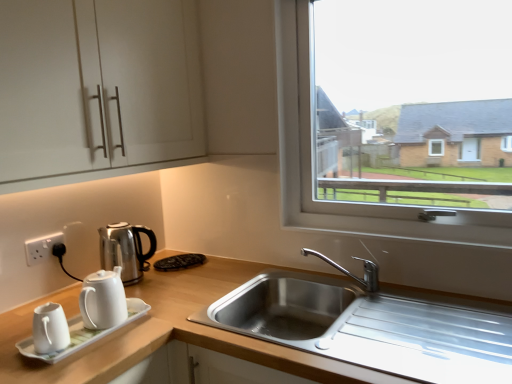
Where is `clear glass window at upper right`? Image resolution: width=512 pixels, height=384 pixels. clear glass window at upper right is located at coordinates (313, 163).

Describe the element at coordinates (93, 315) in the screenshot. I see `white ceramic tea set at lower left` at that location.

Find the location of a particular element. white ceramic tea set at lower left is located at coordinates (93, 315).

Locate an element on the screen. This screenshot has width=512, height=384. white glossy coffee pot at left is located at coordinates (126, 250).

Measure the distance between point (x=133, y=269) and camera.

1.60 meters.

Where is `white plastic electric outlet at lower left`? white plastic electric outlet at lower left is located at coordinates (42, 247).

The image size is (512, 384). Find the location of `white matte cabinet at upper left`. white matte cabinet at upper left is located at coordinates click(239, 76).

Relative to white plastic electric outlet at lower left, is white ceramic tea set at lower left in front or behind?

white ceramic tea set at lower left is in front of white plastic electric outlet at lower left.

Is white ceramic tea set at lower left facing towards white plastic electric outlet at lower left?

No, white ceramic tea set at lower left is not facing towards white plastic electric outlet at lower left.

Between point (49, 357) and point (52, 242), which one is positioned in front?

Point (49, 357)

Who is taller, clear glass window at upper right or white plastic electric outlet at lower left?

With more height is clear glass window at upper right.

I want to click on electric outlet located underneath the clear glass window at upper right (from a real-world perspective), so click(x=42, y=247).

How far apart are clear glass window at upper right and white plastic electric outlet at lower left?

A distance of 3.58 feet exists between clear glass window at upper right and white plastic electric outlet at lower left.

Based on the photo, does clear glass window at upper right have a larger size compared to white plastic electric outlet at lower left?

Correct, clear glass window at upper right is larger in size than white plastic electric outlet at lower left.

Who is smaller, white glossy coffee pot at left or clear glass window at upper right?

With smaller size is white glossy coffee pot at left.

Is point (106, 263) farther from camera compared to point (288, 60)?

That is True.

Is white glossy coffee pot at left inside the boundaries of clear glass window at upper right, or outside?

white glossy coffee pot at left exists outside the volume of clear glass window at upper right.

Is white glossy coffee pot at left not within white ceramic tea set at lower left?

Yes, white glossy coffee pot at left is not within white ceramic tea set at lower left.

Measure the distance from white glossy coffee pot at left to white ceramic tea set at lower left.

The distance of white glossy coffee pot at left from white ceramic tea set at lower left is 12.72 inches.

Locate an element on the screen. This screenshot has height=384, width=512. tea set lying on the right of white glossy coffee pot at left is located at coordinates (93, 315).

Is white glossy coffee pot at left far away from white ceramic tea set at lower left?

Actually, white glossy coffee pot at left and white ceramic tea set at lower left are a little close together.

Consider the image. Is white plastic electric outlet at lower left outside of clear glass window at upper right?

Yes, white plastic electric outlet at lower left is located beyond the bounds of clear glass window at upper right.

Which object is positioned more to the left, white plastic electric outlet at lower left or clear glass window at upper right?

Positioned to the left is white plastic electric outlet at lower left.

From a real-world perspective, is white plastic electric outlet at lower left located beneath clear glass window at upper right?

Indeed, from a real-world perspective, white plastic electric outlet at lower left is positioned beneath clear glass window at upper right.

Considering their positions, is white plastic electric outlet at lower left located in front of or behind clear glass window at upper right?

Visually, white plastic electric outlet at lower left is located behind clear glass window at upper right.

In terms of height, does stainless steel sink at lower center look taller or shorter compared to white matte cabinet at upper left?

In the image, stainless steel sink at lower center appears to be shorter than white matte cabinet at upper left.

From the image's perspective, would you say stainless steel sink at lower center is shown under white matte cabinet at upper left?

Yes, from the image's perspective, stainless steel sink at lower center is below white matte cabinet at upper left.

Considering the relative positions of stainless steel sink at lower center and white matte cabinet at upper left in the image provided, is stainless steel sink at lower center to the left of white matte cabinet at upper left from the viewer's perspective?

Incorrect, stainless steel sink at lower center is not on the left side of white matte cabinet at upper left.

Between point (230, 283) and point (253, 39), which one is positioned in front?

The point (230, 283) is closer to the camera.

From the image's perspective, is white matte cabinet at upper left on top of white plastic electric outlet at lower left?

Indeed, from the image's perspective, white matte cabinet at upper left is shown above white plastic electric outlet at lower left.

From the picture: Considering the positions of objects white matte cabinet at upper left and white plastic electric outlet at lower left in the image provided, who is more to the right, white matte cabinet at upper left or white plastic electric outlet at lower left?

white matte cabinet at upper left is more to the right.

From a real-world perspective, between white matte cabinet at upper left and white plastic electric outlet at lower left, who is vertically higher?

In real-world perspective, white matte cabinet at upper left is above.

Is white matte cabinet at upper left closer to camera compared to white plastic electric outlet at lower left?

Yes.

I want to click on tea set below the white plastic electric outlet at lower left (from a real-world perspective), so click(93, 315).

Where is `electric outlet below the clear glass window at upper right (from the image's perspective)`? The height and width of the screenshot is (384, 512). electric outlet below the clear glass window at upper right (from the image's perspective) is located at coordinates (42, 247).

Considering their positions, is clear glass window at upper right positioned further to stainless steel sink at lower center than white ceramic tea set at lower left?

Based on the image, clear glass window at upper right appears to be further to stainless steel sink at lower center.

Considering their positions, is white ceramic tea set at lower left positioned further to clear glass window at upper right than stainless steel sink at lower center?

white ceramic tea set at lower left is further to clear glass window at upper right.

Which object lies nearer to the anchor point stainless steel sink at lower center, white ceramic tea set at lower left or chrome metallic faucet at sink right?

white ceramic tea set at lower left.

From the image, which object appears to be farther from white ceramic tea set at lower left, white plastic electric outlet at lower left or chrome metallic faucet at sink right?

chrome metallic faucet at sink right is further to white ceramic tea set at lower left.

Considering their positions, is white plastic electric outlet at lower left positioned closer to white matte cabinet at upper left than white ceramic tea set at lower left?

Among the two, white ceramic tea set at lower left is located nearer to white matte cabinet at upper left.

From the image, which object appears to be farther from stainless steel sink at lower center, chrome metallic faucet at sink right or white glossy coffee pot at left?

Based on the image, white glossy coffee pot at left appears to be further to stainless steel sink at lower center.

When comparing their distances from clear glass window at upper right, does white ceramic tea set at lower left or white plastic electric outlet at lower left seem further?

Among the two, white plastic electric outlet at lower left is located further to clear glass window at upper right.

Which object lies further to the anchor point white glossy coffee pot at left, white plastic electric outlet at lower left or clear glass window at upper right?

clear glass window at upper right is positioned further to the anchor white glossy coffee pot at left.

This screenshot has width=512, height=384. In order to click on electric outlet that lies between white matte cabinet at upper left and white glossy coffee pot at left from top to bottom in this screenshot , I will do `click(42, 247)`.

The height and width of the screenshot is (384, 512). I want to click on coffeepot situated between white plastic electric outlet at lower left and chrome metallic faucet at sink right from left to right, so click(126, 250).

The height and width of the screenshot is (384, 512). In order to click on coffeepot located between white matte cabinet at upper left and clear glass window at upper right in the left-right direction in this screenshot , I will do `click(126, 250)`.

Find the location of `tea set between white glossy coffee pot at left and stainless steel sink at lower center from left to right`. tea set between white glossy coffee pot at left and stainless steel sink at lower center from left to right is located at coordinates (93, 315).